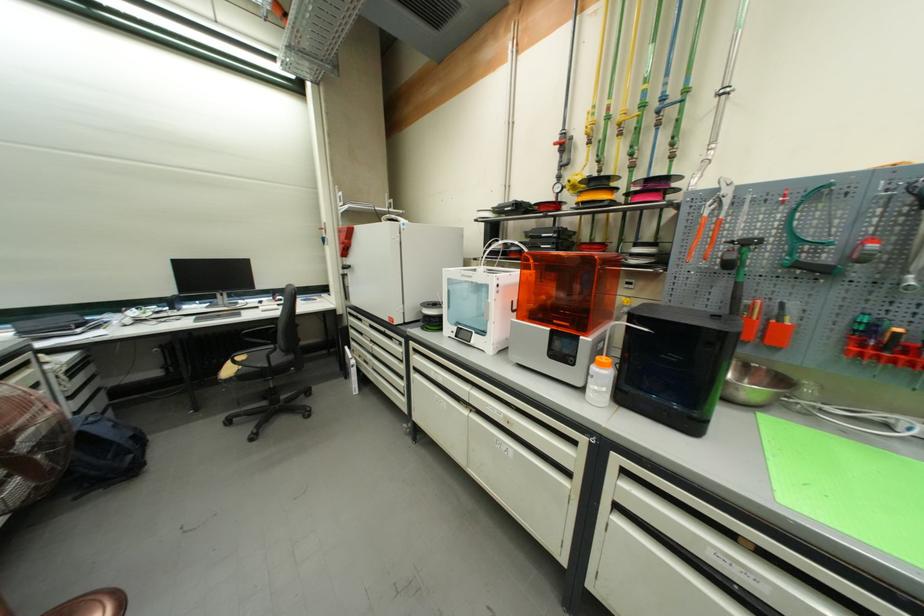
Find where to lift the orange printer lid. Please return your answer as a coordinate pair (x, y).

(566, 286)